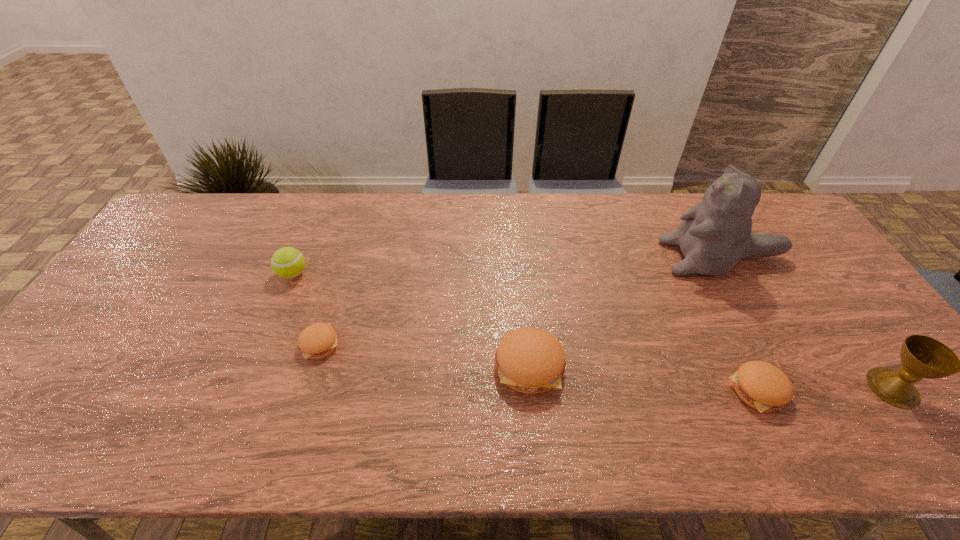
Find the location of a particular element. free space in the image that satisfies the following two spatial constraints: 1. on the front side of the second shortest patty; 2. on the right side of the fourth object from right to left is located at coordinates (532, 390).

Where is `free spot that satisfies the following two spatial constraints: 1. on the back side of the chalice; 2. on the right side of the rightmost patty`? free spot that satisfies the following two spatial constraints: 1. on the back side of the chalice; 2. on the right side of the rightmost patty is located at coordinates (756, 388).

Image resolution: width=960 pixels, height=540 pixels. Identify the location of free point that satisfies the following two spatial constraints: 1. on the face of the tallest object; 2. on the front side of the leftmost object. pyautogui.click(x=733, y=274).

Locate an element on the screen. The width and height of the screenshot is (960, 540). free space that satisfies the following two spatial constraints: 1. on the face of the tallest object; 2. on the front side of the second object from left to right is located at coordinates (772, 344).

Locate an element on the screen. The image size is (960, 540). free location that satisfies the following two spatial constraints: 1. on the front side of the shortest patty; 2. on the left side of the second tallest object is located at coordinates (306, 388).